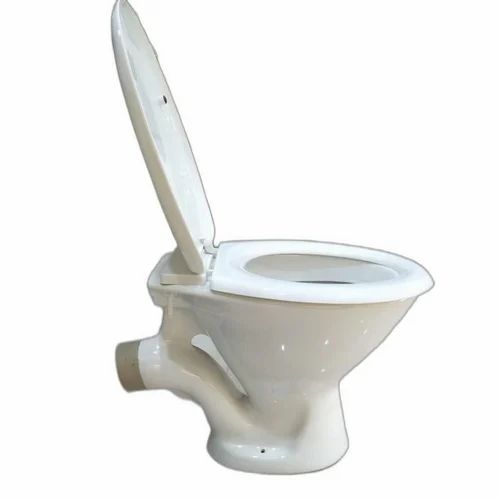
Identify the location of toilet seat. (234, 278).